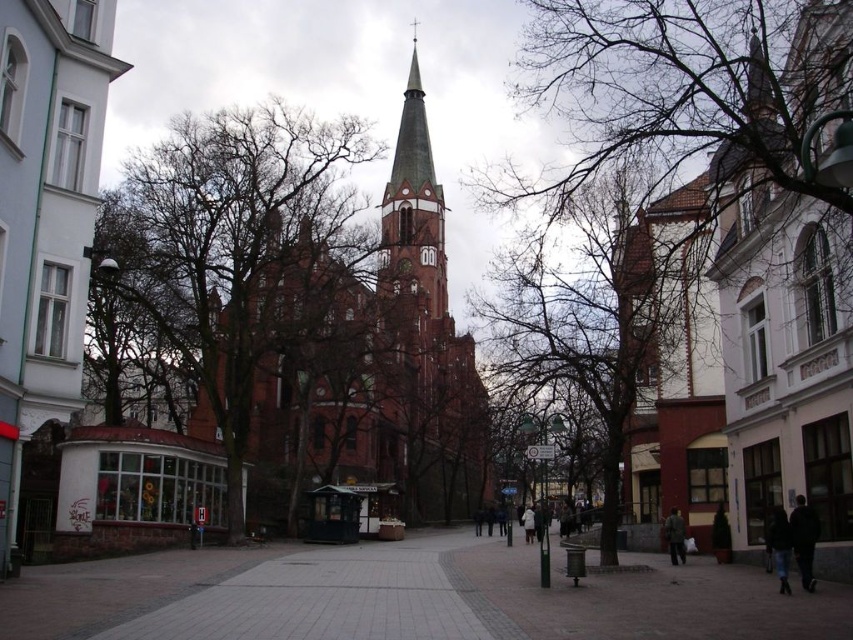
Question: Estimate the real-world distances between objects in this image. Which object is farther from the white wool coat at center?

Choices:
 (A) dark blue jacket at lower right
 (B) bare branches at center
 (C) dark blue jeans at lower right

Answer: (A)

Question: Can you confirm if bare branches at center is bigger than dark blue jacket at lower right?

Choices:
 (A) no
 (B) yes

Answer: (B)

Question: Which of the following is the closest to the observer?

Choices:
 (A) tap(527, 529)
 (B) tap(670, 513)

Answer: (B)

Question: Which point is farther from the camera taking this photo?

Choices:
 (A) (x=683, y=529)
 (B) (x=38, y=376)
 (C) (x=775, y=563)

Answer: (A)

Question: Can you confirm if bare branches at center is thinner than matte brick church at center?

Choices:
 (A) yes
 (B) no

Answer: (B)

Question: Is bare branches at center smaller than dark green fabric jacket at center?

Choices:
 (A) yes
 (B) no

Answer: (B)